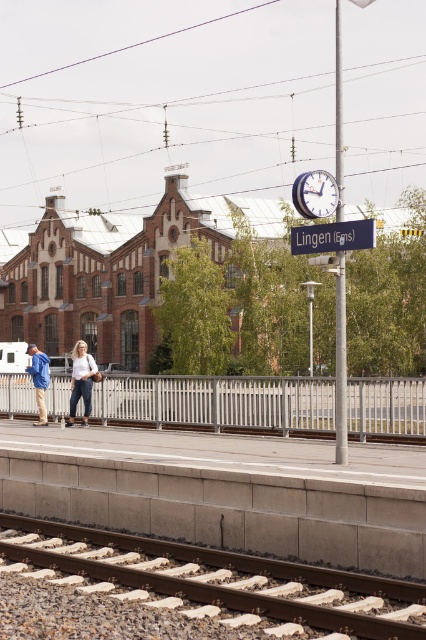
You are standing on the platform at the railway station and want to walk to the brown wooden track at lower center. What is the coordinate of the track you should head towards?

The coordinate of the brown wooden track at lower center is at point (209, 582).

You are standing on the platform and want to reach the brown wooden track at lower center located at point (209, 582). The platform has a low concrete wall along its edge. Can you safely walk directly to that point without crossing the tracks?

The brown wooden track at lower center is located at point (209, 582), which is on the tracks themselves. Since the platform has a low concrete wall along its edge, you cannot safely walk directly to that point without crossing the tracks.